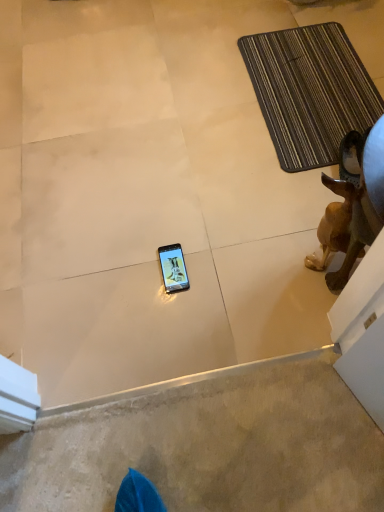
Image resolution: width=384 pixels, height=512 pixels. In order to click on blank space above smooth beige carpet at lower center (from a real-world perspective) in this screenshot , I will do `click(199, 450)`.